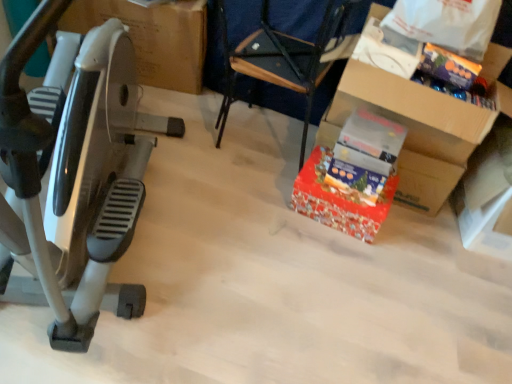
At what (x,y) coordinates should I click in order to perform the action: click on free point to the right of red glossy gift at center, the second gift in the top-to-bottom sequence. Please return your answer as a coordinate pair (x, y). Looking at the image, I should click on (411, 237).